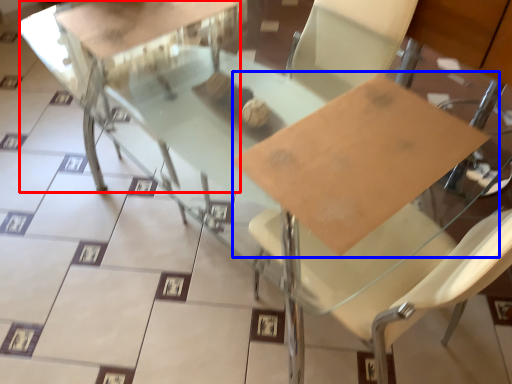
Question: Which point is further to the camera, round table (highlighted by a red box) or cardboard (highlighted by a blue box)?

Choices:
 (A) round table
 (B) cardboard

Answer: (A)